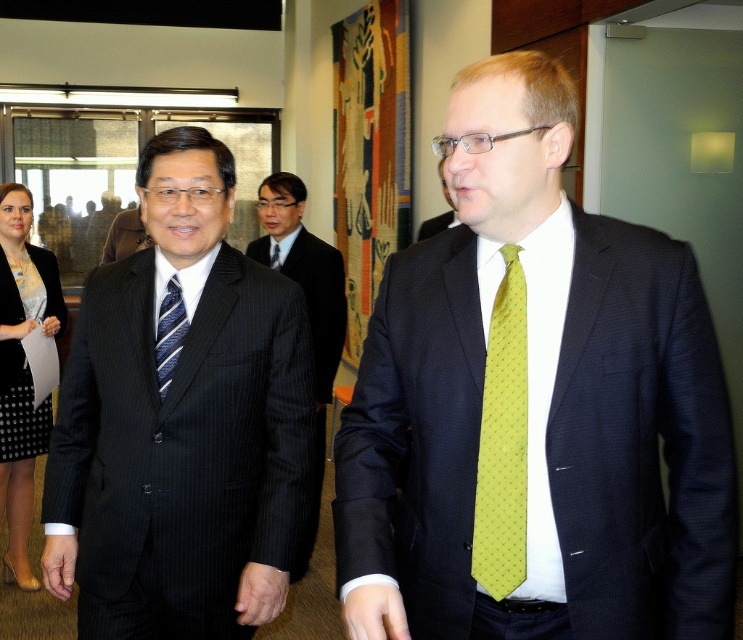
Question: Does dark pinstripe suit at center appear under green dotted tie at center?

Choices:
 (A) no
 (B) yes

Answer: (B)

Question: Which of the following is the farthest from the observer?

Choices:
 (A) (158, 372)
 (B) (690, 282)
 (C) (279, 248)
 (D) (496, 337)

Answer: (C)

Question: Can you confirm if dark pinstripe suit at center is positioned above yellow dotted fabric tie at center?

Choices:
 (A) no
 (B) yes

Answer: (B)

Question: Can you confirm if black dotted fabric dress at lower left is positioned to the left of green dotted tie at center?

Choices:
 (A) yes
 (B) no

Answer: (A)

Question: Which of the following is the farthest from the observer?

Choices:
 (A) black dotted fabric dress at lower left
 (B) black pinstripe suit at center

Answer: (B)

Question: Which of the following is the farthest from the observer?

Choices:
 (A) (484, 436)
 (B) (444, 216)

Answer: (B)